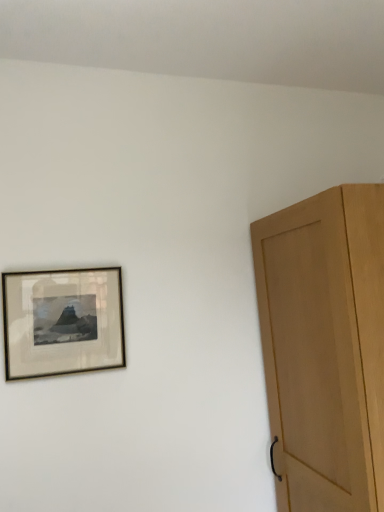
Measure the distance between point (x=70, y=349) and camera.

4.34 feet.

Find the location of a particular element. matte black picture frame at upper left is located at coordinates (62, 322).

What do you see at coordinates (62, 322) in the screenshot?
I see `matte black picture frame at upper left` at bounding box center [62, 322].

Find the location of a particular element. Image resolution: width=384 pixels, height=512 pixels. matte black picture frame at upper left is located at coordinates (62, 322).